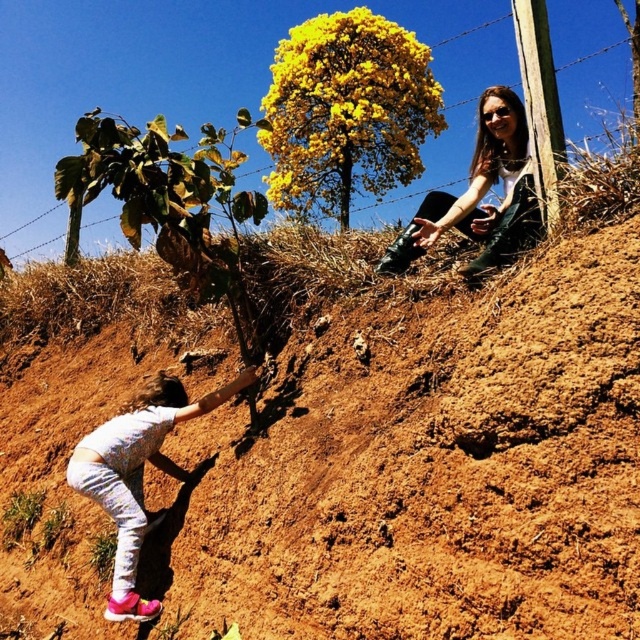
Question: Can you confirm if yellow leafy tree at upper center is positioned to the left of matte black boots at upper right?

Choices:
 (A) no
 (B) yes

Answer: (B)

Question: Which point appears farthest from the camera in this image?

Choices:
 (A) (132, 547)
 (B) (438, 388)
 (C) (387, 148)
 (D) (513, 248)

Answer: (C)

Question: Which point is farther to the camera?

Choices:
 (A) brown dirt at lower right
 (B) yellow leafy tree at upper center
 (C) matte black boots at upper right

Answer: (B)

Question: Estimate the real-world distances between objects in this image. Which object is closer to the matte black boots at upper right?

Choices:
 (A) yellow leafy tree at upper center
 (B) brown dirt at lower right

Answer: (B)

Question: Can you confirm if yellow leafy tree at upper center is positioned to the right of white cotton pants at lower left?

Choices:
 (A) yes
 (B) no

Answer: (A)

Question: Does brown dirt at lower right have a larger size compared to matte black boots at upper right?

Choices:
 (A) no
 (B) yes

Answer: (B)